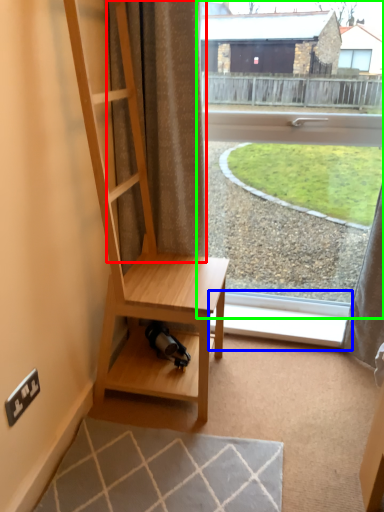
Question: Estimate the real-world distances between objects in this image. Which object is farther from curtain (highlighted by a red box), window sill (highlighted by a blue box) or window (highlighted by a green box)?

Choices:
 (A) window sill
 (B) window

Answer: (B)